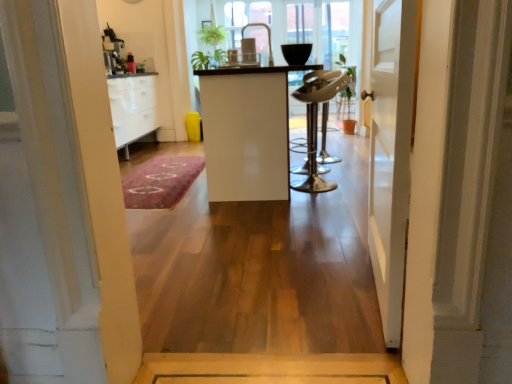
Find the location of a particular element. This screenshot has height=384, width=512. vacant space in front of shiny metallic bar stool at center is located at coordinates (325, 193).